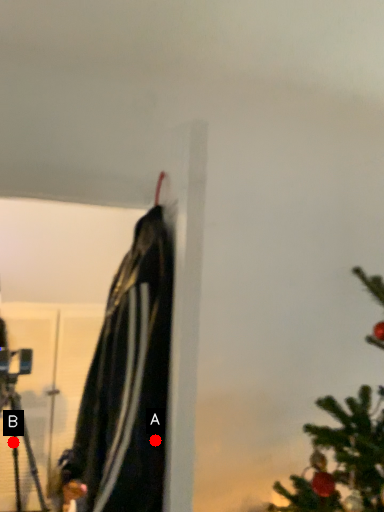
Question: Two points are circled on the image, labeled by A and B beside each circle. Which point is closer to the camera taking this photo?

Choices:
 (A) A is closer
 (B) B is closer

Answer: (A)